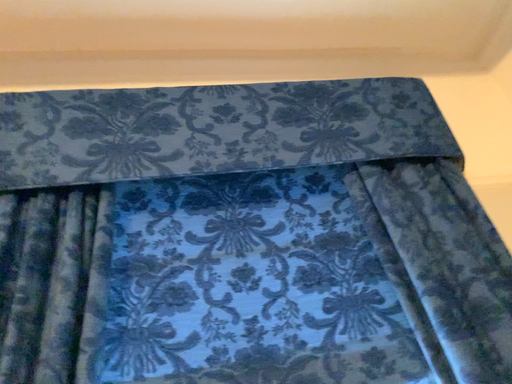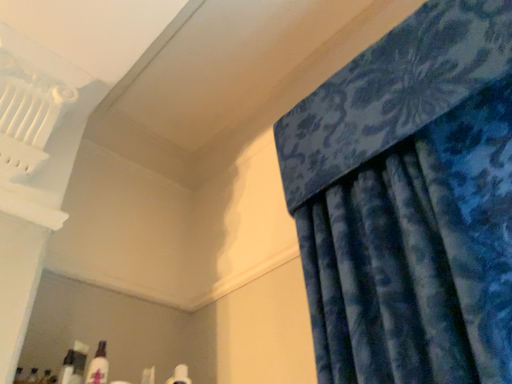
Question: How did the camera likely rotate when shooting the video?

Choices:
 (A) rotated downward
 (B) rotated upward

Answer: (A)